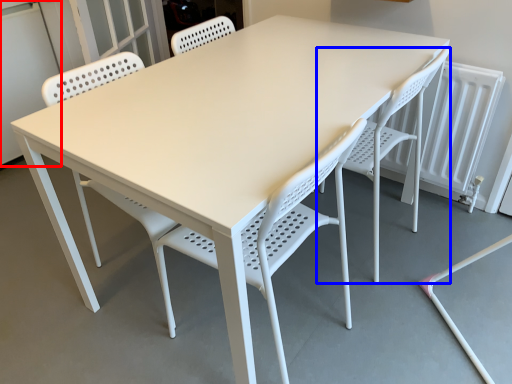
Question: Among these objects, which one is farthest to the camera, screen door (highlighted by a red box) or chair (highlighted by a blue box)?

Choices:
 (A) screen door
 (B) chair

Answer: (A)